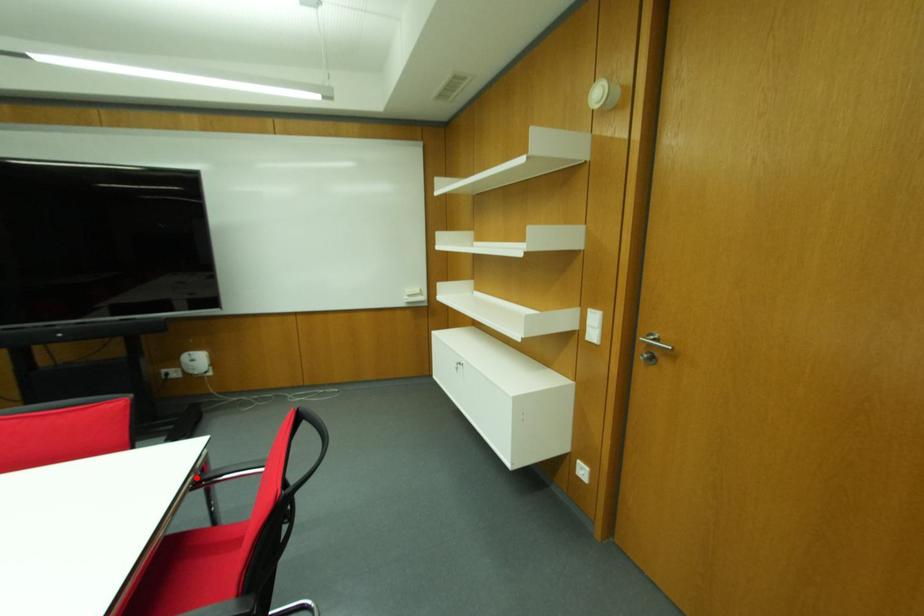
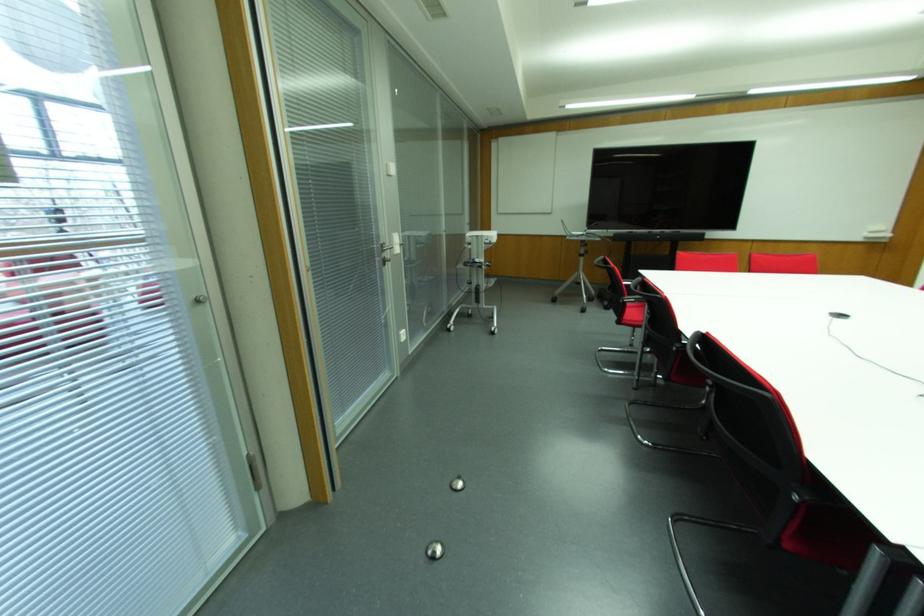
Question: I am providing you with two images of the same scene from different viewpoints. A red point is marked on the first image. Is the red point's position out of view in image 2?

Choices:
 (A) Yes
 (B) No

Answer: (A)